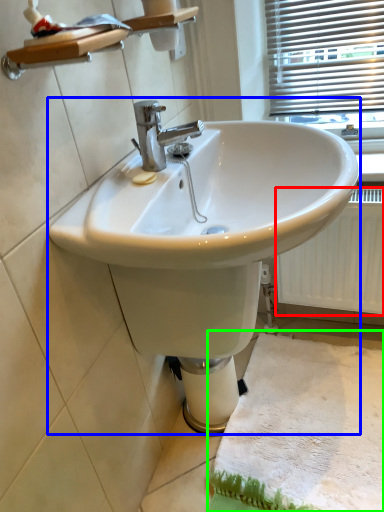
Question: Which object is positioned closest to radiator (highlighted by a red box)? Select from sink (highlighted by a blue box) and bath mat (highlighted by a green box).

Choices:
 (A) sink
 (B) bath mat

Answer: (B)